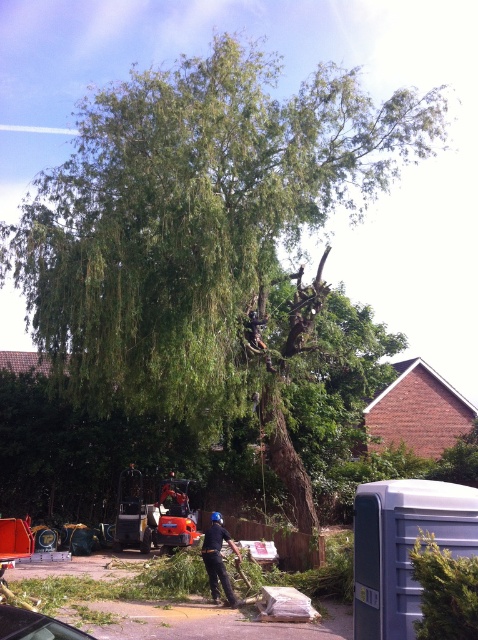
Question: Among these points, which one is farthest from the camera?

Choices:
 (A) (228, 596)
 (B) (63, 634)

Answer: (A)

Question: Is metallic gray car at lower left to the right of black fabric person at center from the viewer's perspective?

Choices:
 (A) no
 (B) yes

Answer: (A)

Question: Does metallic gray car at lower left appear on the left side of black fabric person at center?

Choices:
 (A) no
 (B) yes

Answer: (B)

Question: Which object is closer to the camera taking this photo?

Choices:
 (A) metallic gray car at lower left
 (B) black fabric person at center

Answer: (A)

Question: Is metallic gray car at lower left positioned behind black fabric person at center?

Choices:
 (A) no
 (B) yes

Answer: (A)